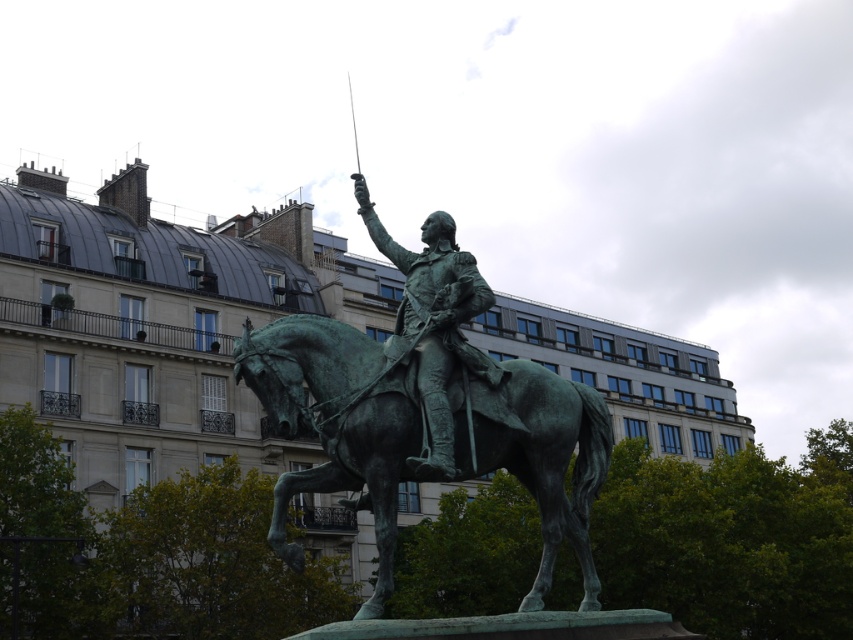
Between green patina horse at center and green patina statue at center, which one is positioned lower?

green patina horse at center is lower down.

Does green patina horse at center have a lesser height compared to green patina statue at center?

Incorrect, green patina horse at center's height does not fall short of green patina statue at center's.

Does point (560, 470) come in front of point (439, 259)?

Yes, it is.

Identify the location of green patina horse at center. (334, 424).